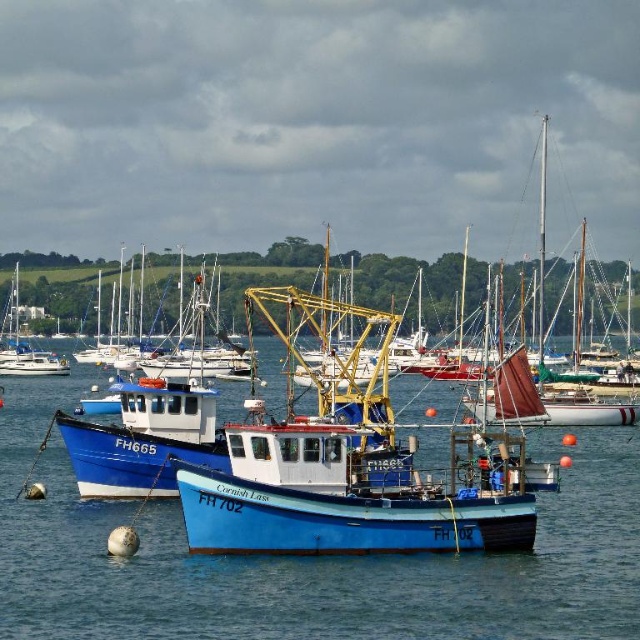
You are a marine biologist observing the harbor scene. You notice a point labeled as point (308, 557) in the image. Based on the scene description, what is located at that point?

The point (308, 557) indicates blue wooden water at center.

You are a photographer planning to capture the harbor scene. You want to ensure that both the blue wooden water at center and the blue painted wooden fishing boat at center are clearly visible in your photo. Based on their spatial relationship, which object should you prioritize framing first to ensure it doesn

The blue painted wooden fishing boat at center occupies more space than the blue wooden water at center, so you should prioritize framing the blue painted wooden fishing boat at center first to ensure it is clearly visible.